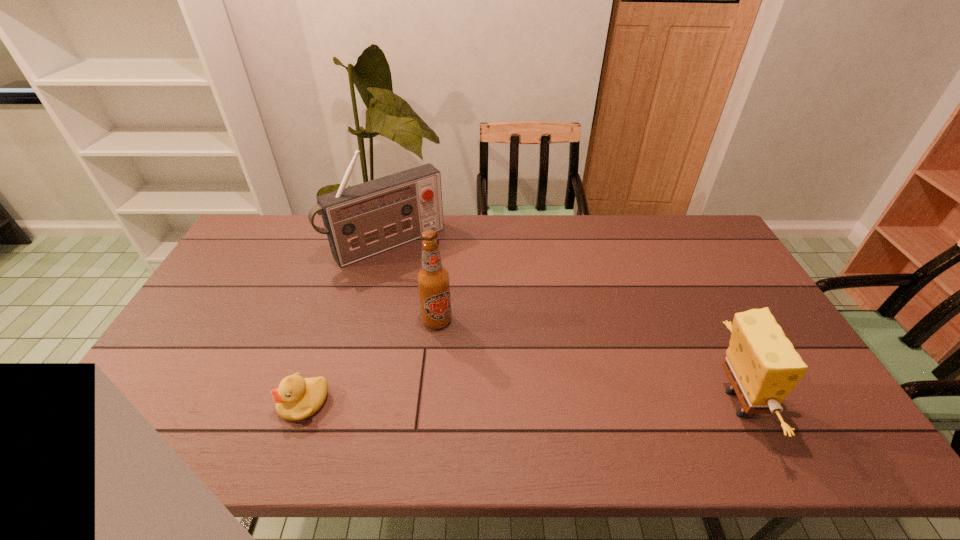
Where is `free space between the farthest object and the shortest object`? This screenshot has width=960, height=540. free space between the farthest object and the shortest object is located at coordinates (346, 323).

Where is `empty space that is in between the radio receiver and the duckling`? This screenshot has width=960, height=540. empty space that is in between the radio receiver and the duckling is located at coordinates (346, 323).

This screenshot has width=960, height=540. Identify the location of vacant space that is in between the rightmost object and the beer bottle. (587, 362).

You are a GUI agent. You are given a task and a screenshot of the screen. Output one action in this format:
    pyautogui.click(x=<x>, y=<y>)
    Task: Click on the vacant area between the radio receiver and the third shortest object
    This screenshot has height=540, width=960.
    Given the screenshot: What is the action you would take?
    pyautogui.click(x=412, y=282)

Image resolution: width=960 pixels, height=540 pixels. Identify the location of free space that is in between the beer bottle and the radio receiver. (412, 282).

Find the location of a particular element. vacant area between the second shortest object and the farthest object is located at coordinates (562, 323).

Find the location of `the closest object to the rightmost object`. the closest object to the rightmost object is located at coordinates (433, 280).

Locate an element on the screen. The image size is (960, 540). the second closest object to the shortest object is located at coordinates [360, 221].

Identify the location of vacant region that satisfies the following two spatial constraints: 1. on the front side of the radio receiver; 2. on the face of the rightmost object. This screenshot has width=960, height=540. (346, 403).

This screenshot has width=960, height=540. I want to click on vacant region that satisfies the following two spatial constraints: 1. on the front side of the sponge; 2. on the face of the radio receiver, so click(x=346, y=403).